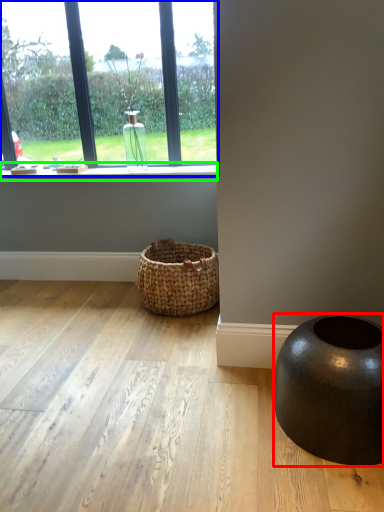
Question: Estimate the real-world distances between objects in this image. Which object is closer to oval (highlighted by a red box), window (highlighted by a blue box) or window sill (highlighted by a green box)?

Choices:
 (A) window
 (B) window sill

Answer: (B)